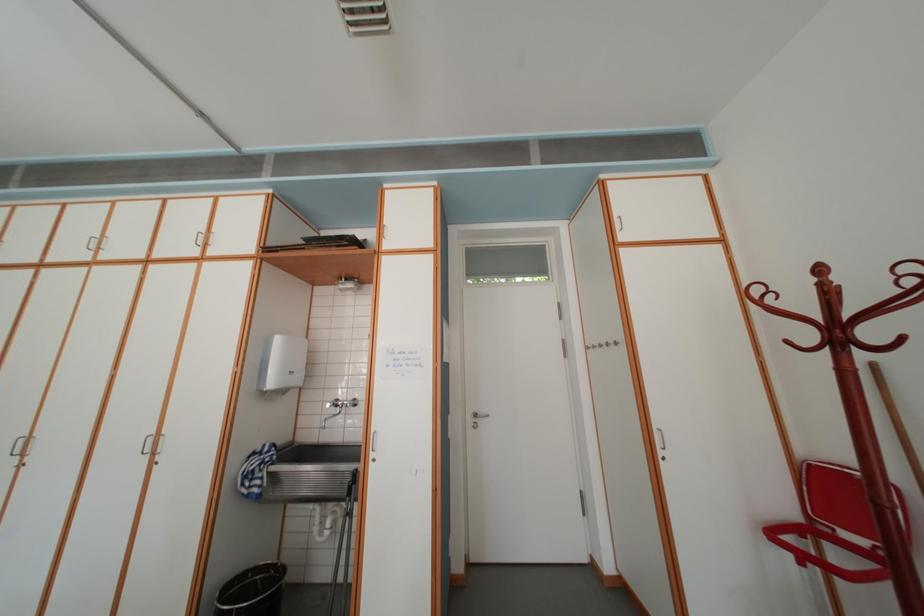
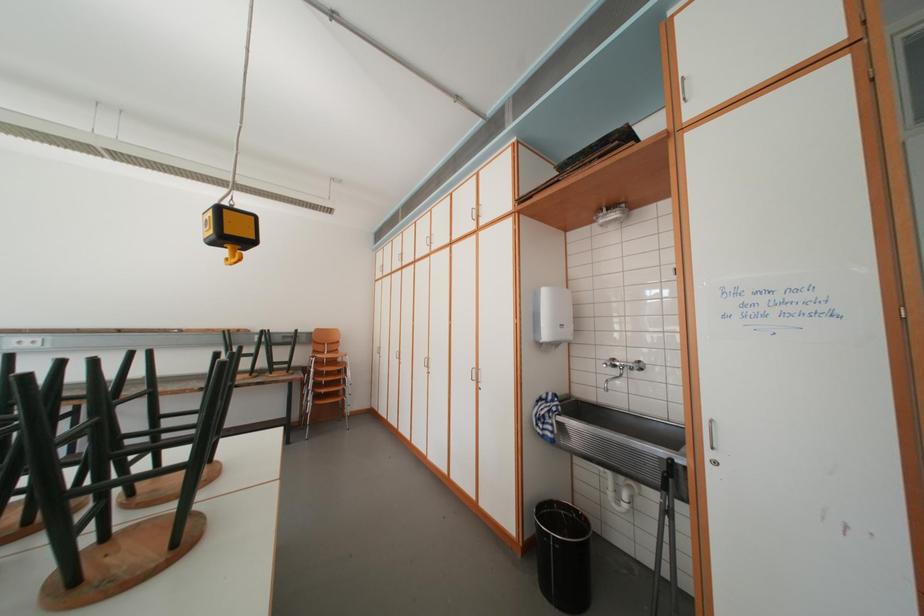
Question: The camera is either moving clockwise (left) or counter-clockwise (right) around the object. The first image is from the beginning of the video and the second image is from the end. Is the camera moving left or right when shooting the video?

Choices:
 (A) Left
 (B) Right

Answer: (B)